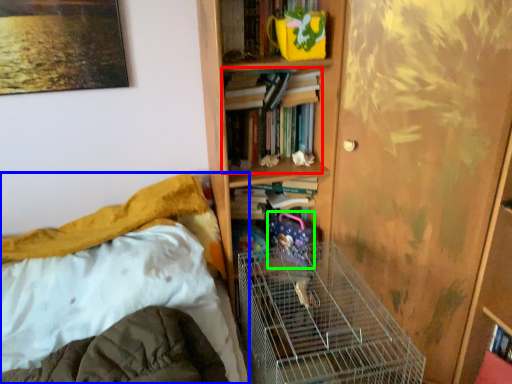
Question: Estimate the real-world distances between objects in this image. Which object is farther from book (highlighted by a red box), bed (highlighted by a blue box) or toy (highlighted by a green box)?

Choices:
 (A) bed
 (B) toy

Answer: (A)